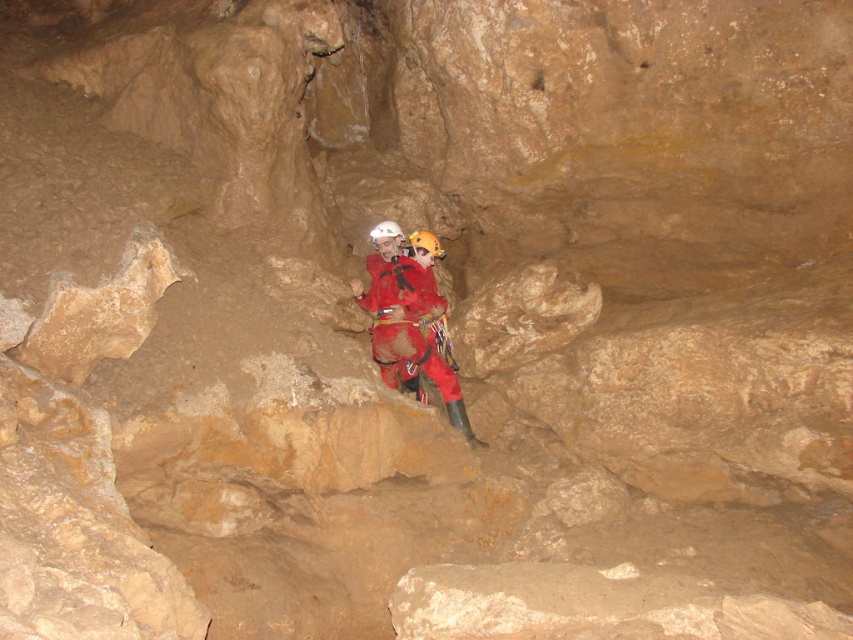
Describe the element at coordinates (387, 237) in the screenshot. I see `white matte helmet at center` at that location.

Describe the element at coordinates (387, 237) in the screenshot. I see `white matte helmet at center` at that location.

At what (x,y) coordinates should I click in order to perform the action: click on white matte helmet at center. Please return your answer as a coordinate pair (x, y). This screenshot has width=853, height=640. Looking at the image, I should click on (387, 237).

Is red matte climbing gear at center wider than white matte helmet at center?

Correct, the width of red matte climbing gear at center exceeds that of white matte helmet at center.

Where is `red matte climbing gear at center`? Image resolution: width=853 pixels, height=640 pixels. red matte climbing gear at center is located at coordinates (409, 330).

Which is below, red matte climbing gear at center or yellow matte helmet at center?

Positioned lower is red matte climbing gear at center.

Can you confirm if red matte climbing gear at center is taller than yellow matte helmet at center?

Yes.

Is point (415, 307) more distant than point (434, 237)?

No, (415, 307) is closer to viewer.

Locate an element on the screen. red matte climbing gear at center is located at coordinates (409, 330).